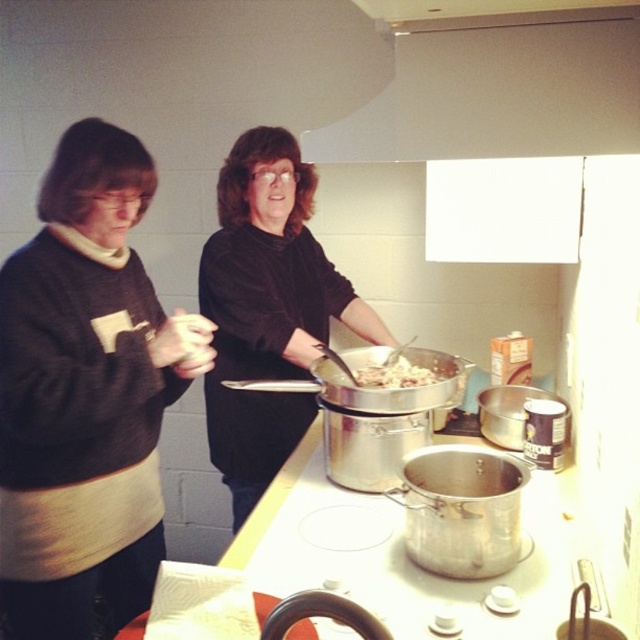
Question: Is white matte exhaust hood at upper center below white creamy food at center?

Choices:
 (A) yes
 (B) no

Answer: (B)

Question: Estimate the real-world distances between objects in this image. Which object is closer to the white matte exhaust hood at upper center?

Choices:
 (A) matte black sweater at left
 (B) white creamy food at center
 (C) black matte shirt at center

Answer: (B)

Question: Does white matte exhaust hood at upper center have a greater width compared to white creamy food at center?

Choices:
 (A) yes
 (B) no

Answer: (A)

Question: Which point is farther from the camera taking this photo?

Choices:
 (A) (116, 419)
 (B) (308, 420)
 (C) (388, 369)

Answer: (B)

Question: Estimate the real-world distances between objects in this image. Which object is farther from the white creamy food at center?

Choices:
 (A) white matte exhaust hood at upper center
 (B) black matte shirt at center

Answer: (A)

Question: Can you confirm if matte black sweater at left is positioned to the left of white creamy food at center?

Choices:
 (A) no
 (B) yes

Answer: (B)